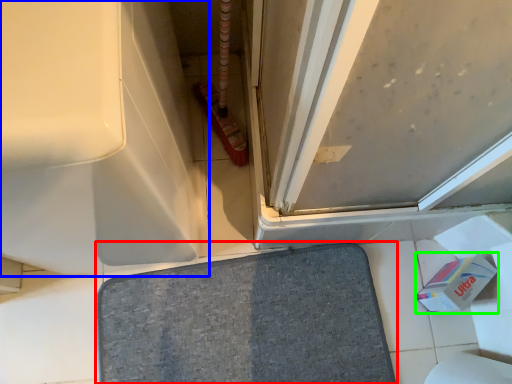
Question: Considering the real-world distances, which object is farthest from bath mat (highlighted by a red box)? bath (highlighted by a blue box) or toilet paper (highlighted by a green box)?

Choices:
 (A) bath
 (B) toilet paper

Answer: (A)